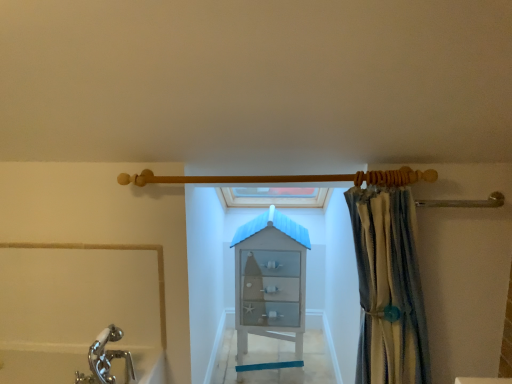
Identify the location of white glass cabinet at center. This screenshot has height=384, width=512. (270, 284).

Measure the distance from striped fabric curtain at right to wooden shower rod at upper center.

They are 43.10 centimeters apart.

Is striped fabric curtain at right directly adjacent to wooden shower rod at upper center?

striped fabric curtain at right and wooden shower rod at upper center are clearly separated.

From the image's perspective, does striped fabric curtain at right appear lower than wooden shower rod at upper center?

Yes, from the image's perspective, striped fabric curtain at right is beneath wooden shower rod at upper center.

Could you tell me if striped fabric curtain at right is facing wooden shower rod at upper center?

No, striped fabric curtain at right does not turn towards wooden shower rod at upper center.

Does point (431, 181) lie in front of point (270, 322)?

Yes, point (431, 181) is closer to viewer.

How distant is wooden shower rod at upper center from white glass cabinet at center?

wooden shower rod at upper center and white glass cabinet at center are 34.19 inches apart from each other.

From the picture: Does wooden shower rod at upper center have a greater width compared to white glass cabinet at center?

No, wooden shower rod at upper center is not wider than white glass cabinet at center.

Locate an element on the screen. Image resolution: width=512 pixels, height=384 pixels. shower in front of the white glass cabinet at center is located at coordinates (291, 178).

Are white glass cabinet at center and wooden shower rod at upper center located far from each other?

No, white glass cabinet at center is not far away from wooden shower rod at upper center.

Considering the positions of objects white glass cabinet at center and wooden shower rod at upper center in the image provided, who is more to the right, white glass cabinet at center or wooden shower rod at upper center?

From the viewer's perspective, white glass cabinet at center appears more on the right side.

Is point (285, 367) positioned after point (405, 197)?

Yes, it is behind point (405, 197).

Is striped fabric curtain at right at the back of white glass cabinet at center?

No, striped fabric curtain at right is not at the back of white glass cabinet at center.

From the image's perspective, which one is positioned higher, white glass cabinet at center or striped fabric curtain at right?

striped fabric curtain at right appears higher in the image.

Considering the sizes of objects wooden shower rod at upper center and striped fabric curtain at right in the image provided, who is wider, wooden shower rod at upper center or striped fabric curtain at right?

striped fabric curtain at right is wider.

Can we say wooden shower rod at upper center lies outside striped fabric curtain at right?

wooden shower rod at upper center lies outside striped fabric curtain at right's area.

Is wooden shower rod at upper center aimed at striped fabric curtain at right?

No, wooden shower rod at upper center is not oriented towards striped fabric curtain at right.

Consider the image. Based on their positions, is wooden shower rod at upper center located to the left or right of striped fabric curtain at right?

wooden shower rod at upper center is to the left of striped fabric curtain at right.

Is striped fabric curtain at right closer to the viewer compared to white glass cabinet at center?

Yes, the depth of striped fabric curtain at right is less than that of white glass cabinet at center.

Considering the positions of points (421, 301) and (243, 248), is point (421, 301) closer to camera compared to point (243, 248)?

Yes.

In the scene shown: Does striped fabric curtain at right appear on the right side of white glass cabinet at center?

Indeed, striped fabric curtain at right is positioned on the right side of white glass cabinet at center.

Looking at this image, could you tell me if striped fabric curtain at right is turned towards white glass cabinet at center?

No, striped fabric curtain at right is not aimed at white glass cabinet at center.

This screenshot has height=384, width=512. Find the location of `shower above the striped fabric curtain at right (from a real-world perspective)`. shower above the striped fabric curtain at right (from a real-world perspective) is located at coordinates (291, 178).

Identify the location of shower in front of the white glass cabinet at center. (291, 178).

Based on their spatial positions, is striped fabric curtain at right or white glass cabinet at center closer to wooden shower rod at upper center?

The object closer to wooden shower rod at upper center is striped fabric curtain at right.

Estimate the real-world distances between objects in this image. Which object is further from striped fabric curtain at right, wooden shower rod at upper center or white glass cabinet at center?

Based on the image, white glass cabinet at center appears to be further to striped fabric curtain at right.

Based on their spatial positions, is striped fabric curtain at right or wooden shower rod at upper center closer to white glass cabinet at center?

striped fabric curtain at right lies closer to white glass cabinet at center than the other object.

From the image, which object appears to be farther from white glass cabinet at center, wooden shower rod at upper center or striped fabric curtain at right?

Based on the image, wooden shower rod at upper center appears to be further to white glass cabinet at center.

Looking at the image, which one is located further to striped fabric curtain at right, white glass cabinet at center or wooden shower rod at upper center?

white glass cabinet at center is positioned further to the anchor striped fabric curtain at right.

Based on their spatial positions, is white glass cabinet at center or striped fabric curtain at right further from wooden shower rod at upper center?

Among the two, white glass cabinet at center is located further to wooden shower rod at upper center.

This screenshot has width=512, height=384. In order to click on shower between striped fabric curtain at right and white glass cabinet at center in the front-back direction in this screenshot , I will do `click(291, 178)`.